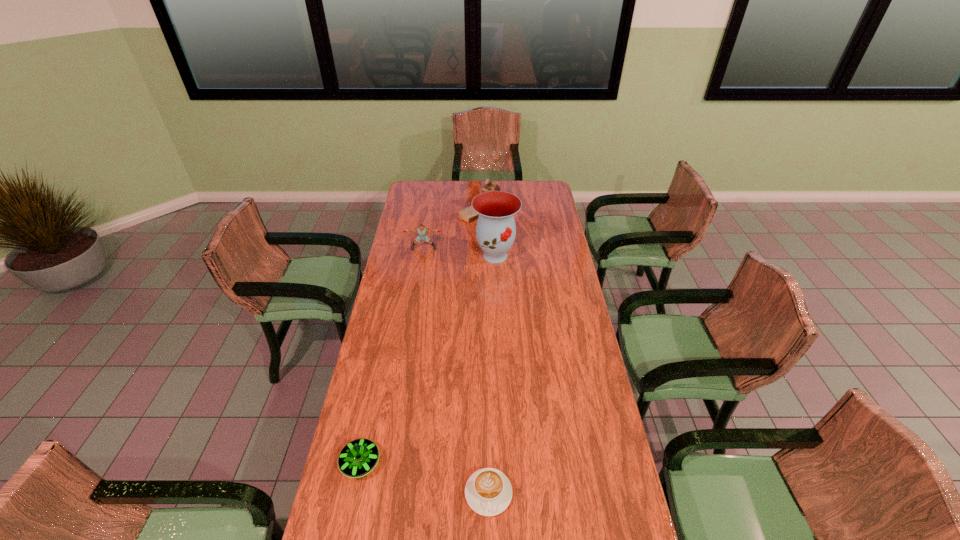
Locate an element on the screen. This screenshot has height=540, width=960. object that stands as the second closest to the saucer is located at coordinates (495, 231).

Locate an element on the screen. This screenshot has width=960, height=540. vacant space that satisfies the following two spatial constraints: 1. on the front-facing side of the vase; 2. on the right side of the farthest object is located at coordinates (486, 255).

I want to click on vacant position in the image that satisfies the following two spatial constraints: 1. on the front-facing side of the farthest object; 2. on the front-facing side of the third shortest object, so click(x=486, y=248).

The height and width of the screenshot is (540, 960). Find the location of `free space that satisfies the following two spatial constraints: 1. on the front-facing side of the figurine; 2. on the front side of the saucer`. free space that satisfies the following two spatial constraints: 1. on the front-facing side of the figurine; 2. on the front side of the saucer is located at coordinates (489, 463).

Locate an element on the screen. vacant space that satisfies the following two spatial constraints: 1. on the front-facing side of the figurine; 2. on the front side of the saucer is located at coordinates (489, 463).

The width and height of the screenshot is (960, 540). Identify the location of vacant region that satisfies the following two spatial constraints: 1. on the front-facing side of the farthest object; 2. on the left side of the vase. (486, 255).